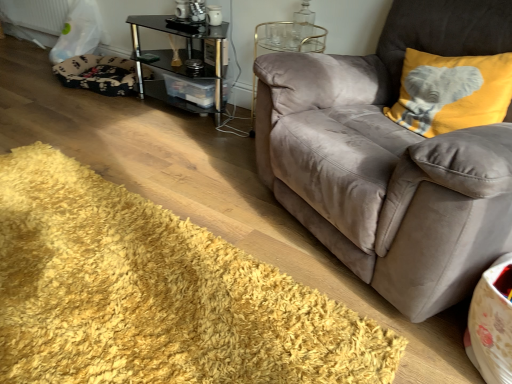
The image size is (512, 384). I want to click on suede gray couch at right, so click(391, 159).

What do you see at coordinates (181, 60) in the screenshot?
I see `black glass table at center` at bounding box center [181, 60].

I want to click on fluffy black and white dog bed at lower left, so click(98, 74).

Where is `suede gray couch at right`? The width and height of the screenshot is (512, 384). suede gray couch at right is located at coordinates (391, 159).

Consider the image. Is yellow plush pillow at upper right completely or partially outside of suede gray couch at right?

No, yellow plush pillow at upper right is inside suede gray couch at right's boundary.

Consider the image. Between yellow plush pillow at upper right and suede gray couch at right, which one has smaller size?

yellow plush pillow at upper right is smaller.

Is yellow plush pillow at upper right not close to suede gray couch at right?

No, yellow plush pillow at upper right is in close proximity to suede gray couch at right.

Is fluffy black and white dog bed at lower left situated inside yellow plush pillow at upper right or outside?

fluffy black and white dog bed at lower left is not inside yellow plush pillow at upper right, it's outside.

What are the coordinates of `dog bed above the yellow plush pillow at upper right (from the image's perspective)` in the screenshot? It's located at (98, 74).

Who is shorter, fluffy black and white dog bed at lower left or yellow plush pillow at upper right?

With less height is fluffy black and white dog bed at lower left.

From the image's perspective, is fluffy black and white dog bed at lower left above or below yellow plush pillow at upper right?

Clearly, from the image's perspective, fluffy black and white dog bed at lower left is above yellow plush pillow at upper right.

Is fluffy black and white dog bed at lower left smaller than suede gray couch at right?

Indeed, fluffy black and white dog bed at lower left has a smaller size compared to suede gray couch at right.

Based on the photo, between fluffy black and white dog bed at lower left and suede gray couch at right, which one is positioned in front?

suede gray couch at right is closer to the camera.

Which object is thinner, fluffy black and white dog bed at lower left or suede gray couch at right?

Thinner between the two is fluffy black and white dog bed at lower left.

Is point (82, 70) closer to camera compared to point (444, 157)?

No, it is behind (444, 157).

Which of these two, black glass table at center or fluffy black and white dog bed at lower left, is thinner?

With smaller width is black glass table at center.

Looking at this image, is black glass table at center bigger or smaller than fluffy black and white dog bed at lower left?

Considering their sizes, black glass table at center takes up more space than fluffy black and white dog bed at lower left.

Could you tell me if black glass table at center is facing fluffy black and white dog bed at lower left?

No, black glass table at center does not turn towards fluffy black and white dog bed at lower left.

Considering the positions of objects yellow plush pillow at upper right and black glass table at center in the image provided, who is more to the right, yellow plush pillow at upper right or black glass table at center?

yellow plush pillow at upper right is more to the right.

From the image's perspective, does yellow plush pillow at upper right appear higher than black glass table at center?

No.

Which of these two, yellow plush pillow at upper right or black glass table at center, is smaller?

With smaller size is yellow plush pillow at upper right.

From the image's perspective, relative to yellow plush pillow at upper right, is suede gray couch at right above or below?

suede gray couch at right is situated lower than yellow plush pillow at upper right in the image.

Is suede gray couch at right positioned beyond the bounds of yellow plush pillow at upper right?

Absolutely, suede gray couch at right is external to yellow plush pillow at upper right.

Can you confirm if suede gray couch at right is shorter than yellow plush pillow at upper right?

In fact, suede gray couch at right may be taller than yellow plush pillow at upper right.

Can you confirm if suede gray couch at right is bigger than yellow plush pillow at upper right?

Indeed, suede gray couch at right has a larger size compared to yellow plush pillow at upper right.

Considering the sizes of objects fluffy black and white dog bed at lower left and yellow shaggy rug at lower left in the image provided, who is smaller, fluffy black and white dog bed at lower left or yellow shaggy rug at lower left?

With smaller size is fluffy black and white dog bed at lower left.

Who is shorter, fluffy black and white dog bed at lower left or yellow shaggy rug at lower left?

yellow shaggy rug at lower left is shorter.

Between point (58, 71) and point (336, 323), which one is positioned behind?

The point (58, 71) is behind.

What are the coordinates of `throw pillow behind the suede gray couch at right` in the screenshot? It's located at (451, 92).

This screenshot has height=384, width=512. In order to click on dog bed above the yellow plush pillow at upper right (from the image's perspective) in this screenshot , I will do `click(98, 74)`.

Considering their positions, is suede gray couch at right positioned further to fluffy black and white dog bed at lower left than black glass table at center?

suede gray couch at right is positioned further to the anchor fluffy black and white dog bed at lower left.

Looking at the image, which one is located further to yellow shaggy rug at lower left, black glass table at center or yellow plush pillow at upper right?

black glass table at center lies further to yellow shaggy rug at lower left than the other object.

Based on their spatial positions, is yellow shaggy rug at lower left or black glass table at center closer to suede gray couch at right?

Based on the image, yellow shaggy rug at lower left appears to be nearer to suede gray couch at right.

Estimate the real-world distances between objects in this image. Which object is closer to black glass table at center, yellow plush pillow at upper right or suede gray couch at right?

suede gray couch at right is positioned closer to the anchor black glass table at center.

Based on their spatial positions, is yellow shaggy rug at lower left or fluffy black and white dog bed at lower left closer to suede gray couch at right?

yellow shaggy rug at lower left.

Which object lies further to the anchor point fluffy black and white dog bed at lower left, yellow shaggy rug at lower left or suede gray couch at right?

suede gray couch at right lies further to fluffy black and white dog bed at lower left than the other object.

Looking at this image, looking at the image, which one is located closer to black glass table at center, fluffy black and white dog bed at lower left or yellow shaggy rug at lower left?

fluffy black and white dog bed at lower left is positioned closer to the anchor black glass table at center.

In the scene shown: Considering their positions, is suede gray couch at right positioned closer to yellow plush pillow at upper right than fluffy black and white dog bed at lower left?

The object closer to yellow plush pillow at upper right is suede gray couch at right.

The width and height of the screenshot is (512, 384). Identify the location of studio couch between yellow shaggy rug at lower left and fluffy black and white dog bed at lower left from front to back. (391, 159).

Find the location of `studio couch located between yellow shaggy rug at lower left and black glass table at center in the depth direction`. studio couch located between yellow shaggy rug at lower left and black glass table at center in the depth direction is located at coordinates (391, 159).

Identify the location of throw pillow between suede gray couch at right and fluffy black and white dog bed at lower left from front to back. Image resolution: width=512 pixels, height=384 pixels. tap(451, 92).

Find the location of a particular element. The width and height of the screenshot is (512, 384). throw pillow located between yellow shaggy rug at lower left and black glass table at center in the depth direction is located at coordinates (451, 92).